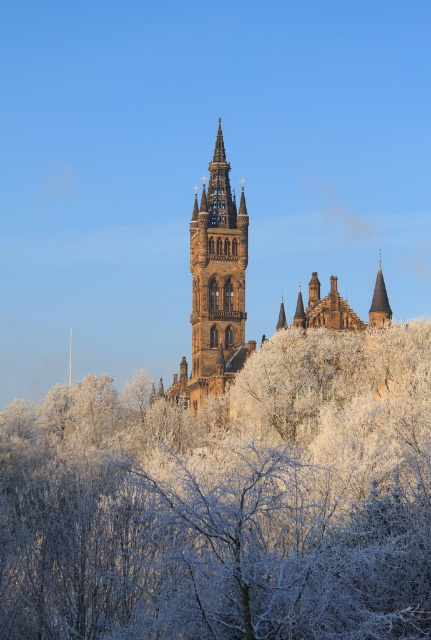
You are an architect analyzing the layout of the historic building. You notice the frosted white branches at center and the smooth brown spire at upper right. Which object is located to the left of the other?

The frosted white branches at center is positioned on the left side of smooth brown spire at upper right.

You are standing in front of the historic building and want to take a photo of the brown stone church at center without any obstructions. Are the frosted white branches at center blocking your view of the church?

The frosted white branches at center are in front of the brown stone church at center, so they are blocking the view of the church. You would need to move the branches or find a different angle to capture an unobstructed photo of the church.

You are an architect planning to install a new lighting system for the historic building. You need to determine if the distance between the frosted white branches at center and the smooth brown spire at upper right is sufficient to safely install a cable that requires a minimum of 80 feet of clearance. Based on the scene, can the cable be installed with the required clearance?

The distance between the frosted white branches at center and the smooth brown spire at upper right is 85.54 feet, which exceeds the minimum required clearance of 80 feet. Therefore, the cable can be safely installed with the required clearance.